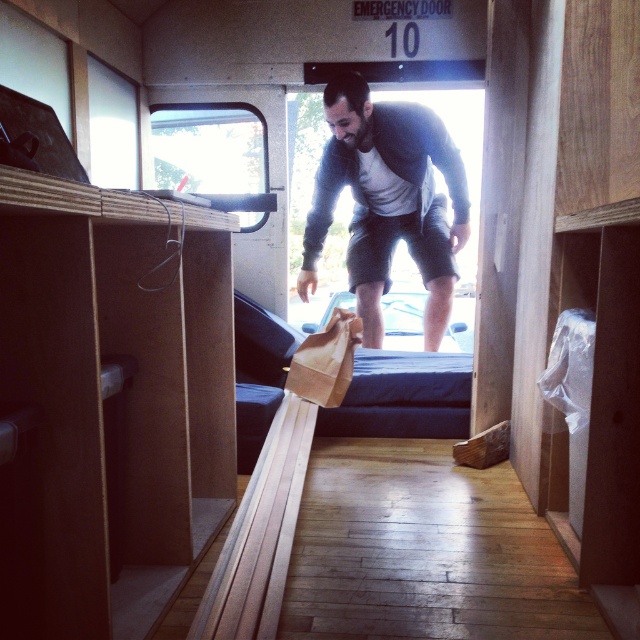
You are a person trying to decide whether to wear the gray cotton shirt at center over the dark blue fabric bed at center. Can you determine which item is taller?

The gray cotton shirt at center is taller than the dark blue fabric bed at center.

You are a delivery person who needs to place a large package that is 1.2 meters wide into the vehicle. The package must fit between the gray cotton shirt at center and the dark blue fabric bed at center. Can the package fit based on their widths?

The gray cotton shirt at center might be wider than dark blue fabric bed at center, but without exact measurements, it is uncertain if the combined width of both objects allows enough space for the 1.2 meter package. Further measurement is needed.

From the picture: You are inside the vehicle and need to move from the point at coordinates point (320, 220) to the point at coordinates point (337, 429). Which direction should you move in?

Since point (320, 220) is behind point (337, 429), you should move forward to reach it.